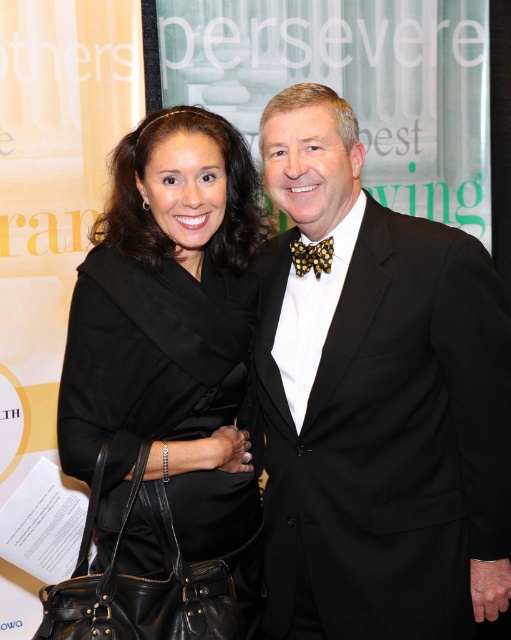
Question: Observing the image, what is the correct spatial positioning of black satin suit at center in reference to yellow dotted bow tie at center?

Choices:
 (A) below
 (B) above

Answer: (A)

Question: Does black leather handbag at lower left appear on the left side of yellow dotted bow tie at center?

Choices:
 (A) no
 (B) yes

Answer: (B)

Question: Which object appears closest to the camera in this image?

Choices:
 (A) black satin suit at center
 (B) yellow dotted bow tie at center

Answer: (A)

Question: Does black leather handbag at lower left have a smaller size compared to yellow dotted bow tie at center?

Choices:
 (A) yes
 (B) no

Answer: (B)

Question: Which is nearer to the black satin suit at center?

Choices:
 (A) yellow dotted bow tie at center
 (B) black leather handbag at lower left

Answer: (B)

Question: Which of the following is the closest to the observer?

Choices:
 (A) (240, 275)
 (B) (362, 339)

Answer: (B)